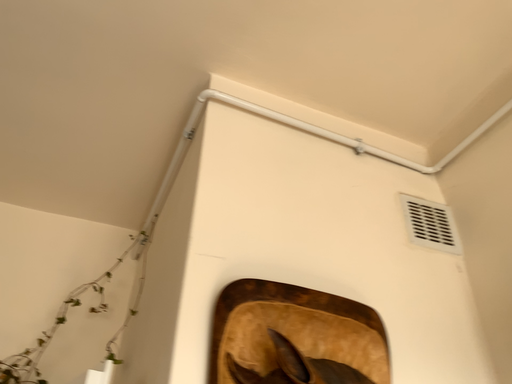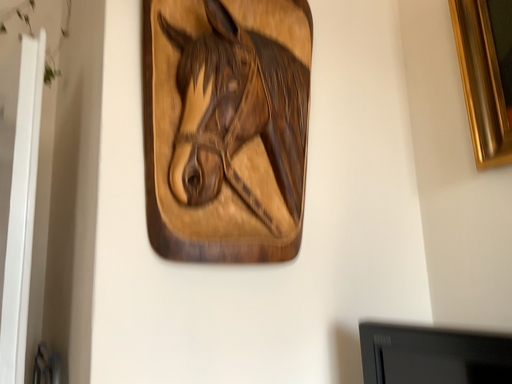
Question: Which way did the camera rotate in the video?

Choices:
 (A) rotated upward
 (B) rotated downward

Answer: (B)